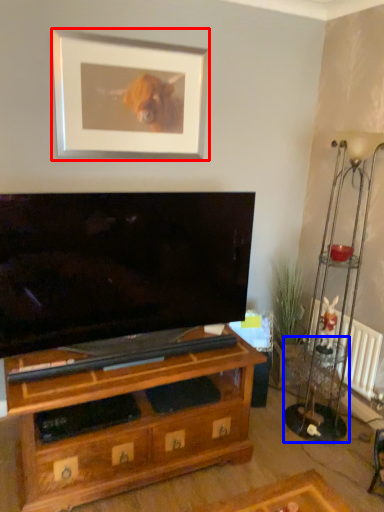
Question: Which object appears farthest to the camera in this image, picture frame (highlighted by a red box) or side table (highlighted by a blue box)?

Choices:
 (A) picture frame
 (B) side table

Answer: (B)